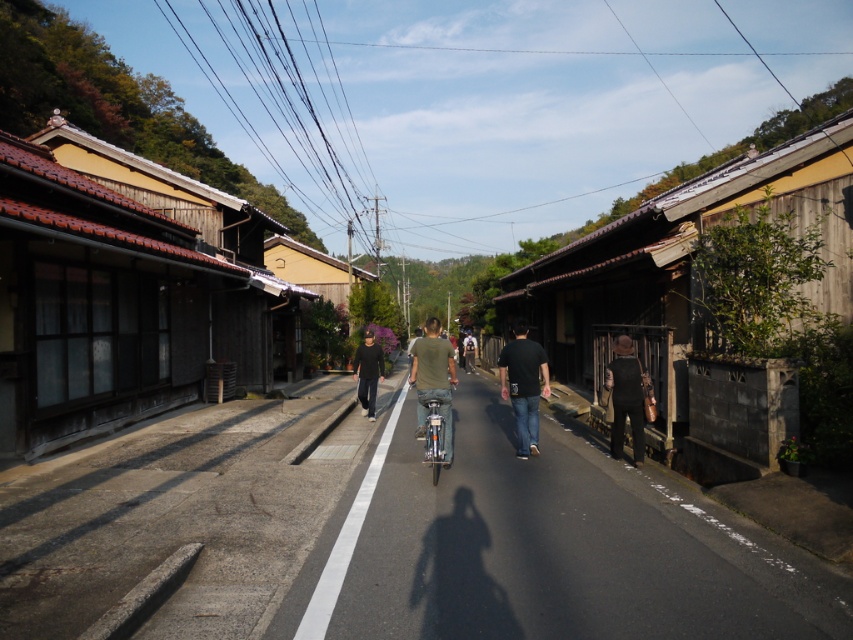
Can you confirm if dark brown leather jacket at lower right is positioned below dark gray sweater at center?

Correct, dark brown leather jacket at lower right is located below dark gray sweater at center.

Is point (634, 461) positioned behind point (372, 346)?

No, (634, 461) is in front of (372, 346).

Is point (640, 394) more distant than point (358, 380)?

No, it is in front of (358, 380).

This screenshot has height=640, width=853. What are the coordinates of `dark brown leather jacket at lower right` in the screenshot? It's located at (625, 397).

Is green matte shirt at center to the right of dark gray sweater at center from the viewer's perspective?

Correct, you'll find green matte shirt at center to the right of dark gray sweater at center.

Is green matte shirt at center above dark gray sweater at center?

Correct, green matte shirt at center is located above dark gray sweater at center.

The height and width of the screenshot is (640, 853). What do you see at coordinates (433, 381) in the screenshot?
I see `green matte shirt at center` at bounding box center [433, 381].

This screenshot has width=853, height=640. Identify the location of green matte shirt at center. (433, 381).

Is smooth asphalt road at center to the left of green matte shirt at center from the viewer's perspective?

No, smooth asphalt road at center is not to the left of green matte shirt at center.

Is smooth asphalt road at center in front of green matte shirt at center?

That is True.

Is point (407, 438) positioned before point (431, 317)?

Yes, point (407, 438) is closer to viewer.

Locate an element on the screen. This screenshot has height=640, width=853. smooth asphalt road at center is located at coordinates click(550, 547).